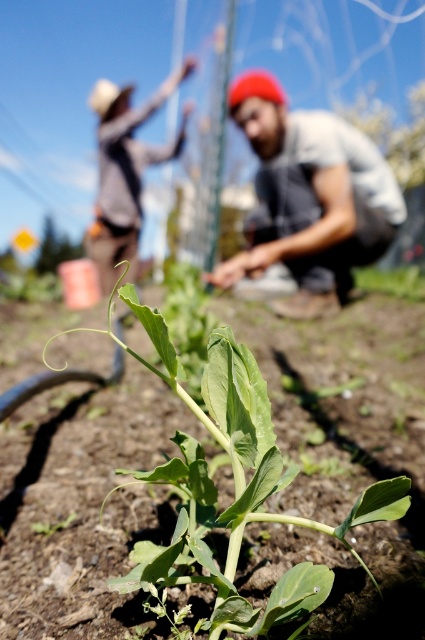
Looking at this image, you are a gardener who wants to know if the green leafy plant at center is shorter than the gray fabric shirt at center. Can you confirm this?

The green leafy plant at center has a lesser height compared to gray fabric shirt at center, so yes, the green leafy plant at center is shorter than the gray fabric shirt at center.

You are standing in the garden and want to place a small decoration between the two points, point (263, 464) and point (251, 220). Which point is closer to you so you can start placing the decoration there?

Point (263, 464) is closer to the viewer than point (251, 220), so you should start placing the decoration near point (263, 464) first.

You are a gardener standing in the outdoor scene. You notice the green leafy plant at center and the gray fabric shirt at center. Which object is closer to the ground?

The green leafy plant at center is positioned under the gray fabric shirt at center, so the green leafy plant at center is closer to the ground.